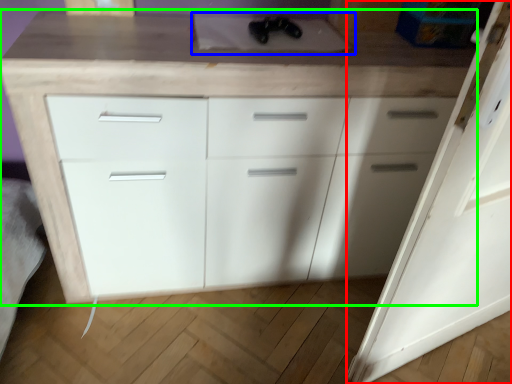
Question: Which object is the farthest from door (highlighted by a red box)? Choose among these: sink (highlighted by a blue box) or chest of drawers (highlighted by a green box).

Choices:
 (A) sink
 (B) chest of drawers

Answer: (A)